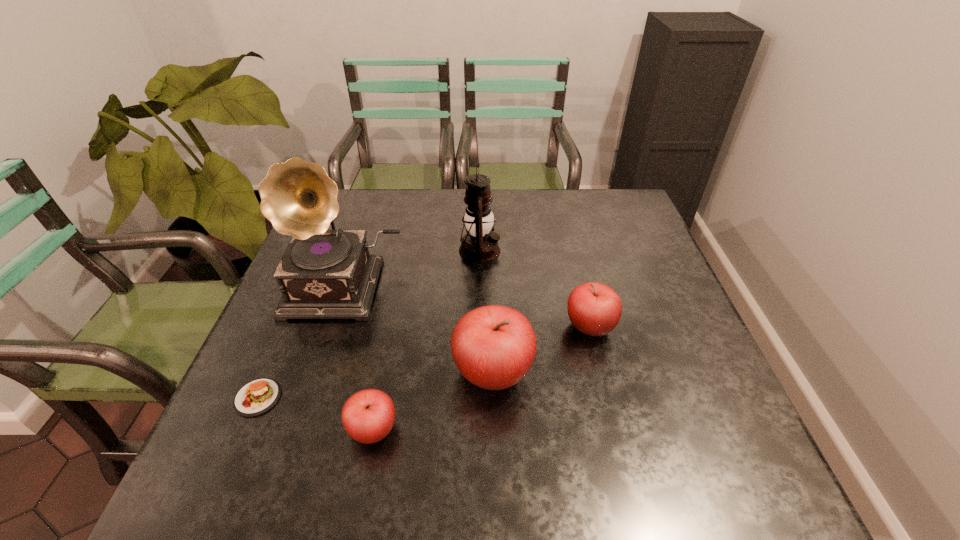
Image resolution: width=960 pixels, height=540 pixels. Identify the location of free spot between the fifth tallest object and the shortest object. (316, 414).

Image resolution: width=960 pixels, height=540 pixels. I want to click on vacant point located between the fifth shortest object and the tallest object, so click(x=412, y=269).

Point out which object is positioned as the third nearest to the second tallest object. Please provide its 2D coordinates. Your answer should be formatted as a tuple, i.e. [(x, y)], where the tuple contains the x and y coordinates of a point satisfying the conditions above.

[(493, 347)]

Identify which object is the closest to the lantern. Please provide its 2D coordinates. Your answer should be formatted as a tuple, i.e. [(x, y)], where the tuple contains the x and y coordinates of a point satisfying the conditions above.

[(323, 274)]

Where is `apple that is the second closest one to the second shortest apple`? Image resolution: width=960 pixels, height=540 pixels. apple that is the second closest one to the second shortest apple is located at coordinates (368, 416).

Where is `the second closest apple to the rightmost object`? This screenshot has width=960, height=540. the second closest apple to the rightmost object is located at coordinates tap(368, 416).

Where is `vacant area that satisfies the following two spatial constraints: 1. on the front side of the nearest apple; 2. on the right side of the shortest object`? The width and height of the screenshot is (960, 540). vacant area that satisfies the following two spatial constraints: 1. on the front side of the nearest apple; 2. on the right side of the shortest object is located at coordinates (244, 430).

I want to click on free spot that satisfies the following two spatial constraints: 1. on the horn of the rightmost object; 2. on the left side of the record player, so click(x=331, y=327).

Locate an element on the screen. This screenshot has width=960, height=540. free location that satisfies the following two spatial constraints: 1. on the side of the tallest apple, there is a wick adjustment knob; 2. on the left side of the lantern is located at coordinates (480, 373).

The image size is (960, 540). I want to click on free space that satisfies the following two spatial constraints: 1. on the side of the lantern, there is a wick adjustment knob; 2. on the horn of the record player, so click(480, 287).